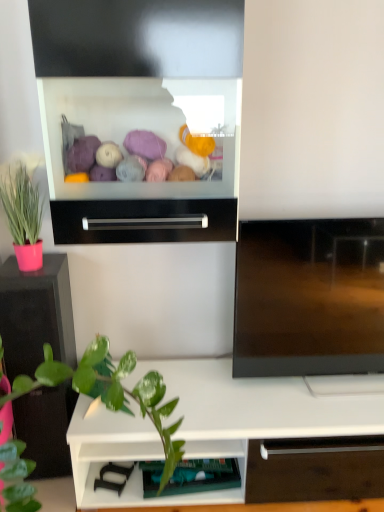
Question: Considering the relative sizes of teal fabric drawer at lower center, the second shelf in the right-to-left sequence, and black glossy tv cabinet at left in the image provided, is teal fabric drawer at lower center, the second shelf in the right-to-left sequence, bigger than black glossy tv cabinet at left?

Choices:
 (A) no
 (B) yes

Answer: (A)

Question: From a real-world perspective, is teal fabric drawer at lower center, which is counted as the 1th shelf, starting from the left, located higher than black glossy tv cabinet at left?

Choices:
 (A) yes
 (B) no

Answer: (B)

Question: Considering the relative positions of teal fabric drawer at lower center, the second shelf in the right-to-left sequence, and black glossy tv cabinet at left in the image provided, is teal fabric drawer at lower center, the second shelf in the right-to-left sequence, in front of black glossy tv cabinet at left?

Choices:
 (A) yes
 (B) no

Answer: (B)

Question: From the image's perspective, would you say teal fabric drawer at lower center, the second shelf in the right-to-left sequence, is positioned over black glossy tv cabinet at left?

Choices:
 (A) no
 (B) yes

Answer: (A)

Question: Does teal fabric drawer at lower center, which is counted as the 1th shelf, starting from the left, have a lesser width compared to black glossy tv cabinet at left?

Choices:
 (A) yes
 (B) no

Answer: (A)

Question: Does teal fabric drawer at lower center, the second shelf in the right-to-left sequence, have a greater width compared to black glossy tv cabinet at left?

Choices:
 (A) yes
 (B) no

Answer: (B)

Question: Is black glossy tv cabinet at left positioned far away from black metallic drawer at center?

Choices:
 (A) no
 (B) yes

Answer: (A)

Question: Does black glossy tv cabinet at left appear on the right side of black metallic drawer at center?

Choices:
 (A) yes
 (B) no

Answer: (B)

Question: Can you confirm if black glossy tv cabinet at left is positioned to the left of black metallic drawer at center?

Choices:
 (A) yes
 (B) no

Answer: (A)

Question: From a real-world perspective, is black glossy tv cabinet at left located beneath black metallic drawer at center?

Choices:
 (A) no
 (B) yes

Answer: (B)

Question: Considering the relative sizes of black glossy tv cabinet at left and black metallic drawer at center in the image provided, is black glossy tv cabinet at left thinner than black metallic drawer at center?

Choices:
 (A) no
 (B) yes

Answer: (A)

Question: From the image's perspective, is black glossy tv cabinet at left below black metallic drawer at center?

Choices:
 (A) yes
 (B) no

Answer: (A)

Question: Is white matte shelf at lower center, the 1th shelf viewed from the right, wider than pink matte pot at left?

Choices:
 (A) no
 (B) yes

Answer: (B)